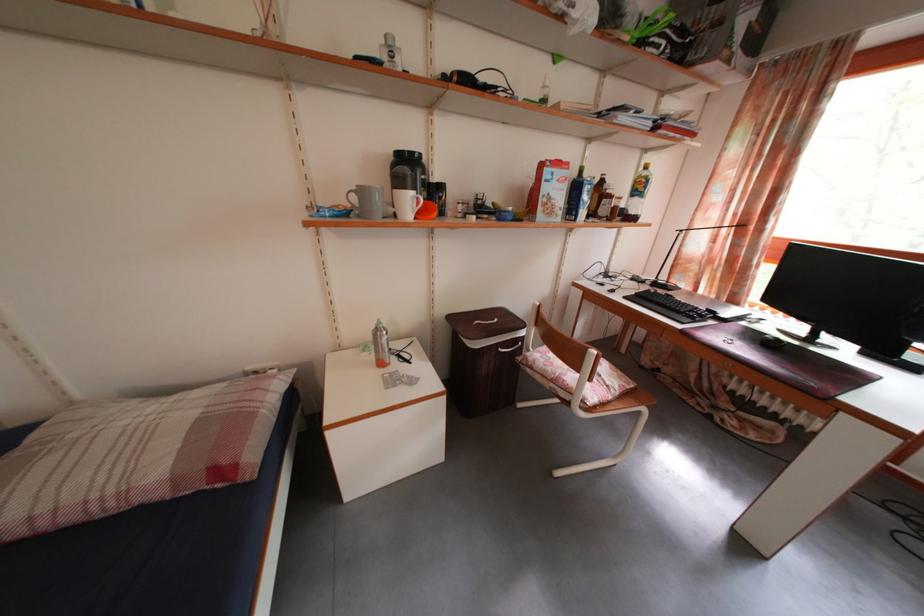
Find where to lift the grey mug handle. Please return your answer as a coordinate pair (x, y).

(368, 201)